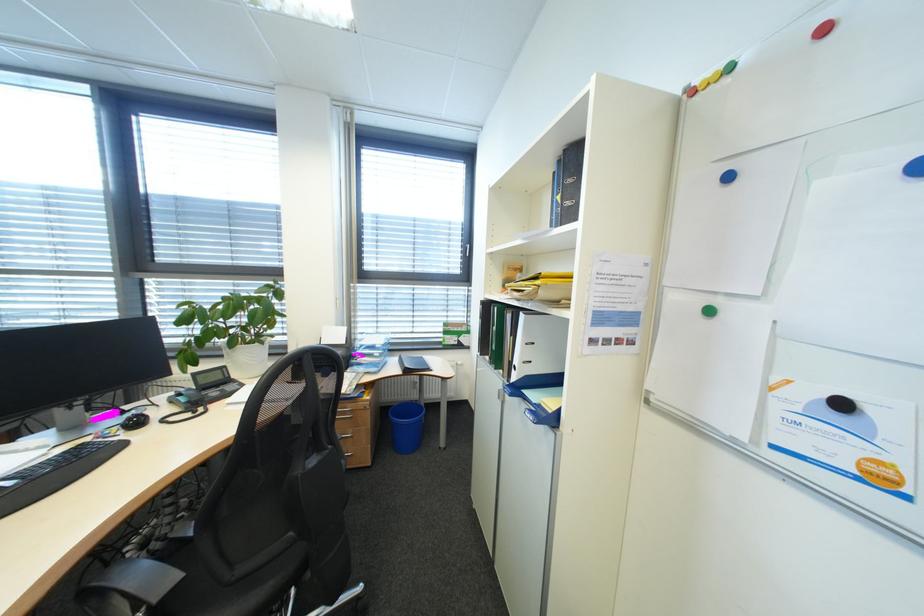
Where is `blue trash can`? blue trash can is located at coordinates click(406, 426).